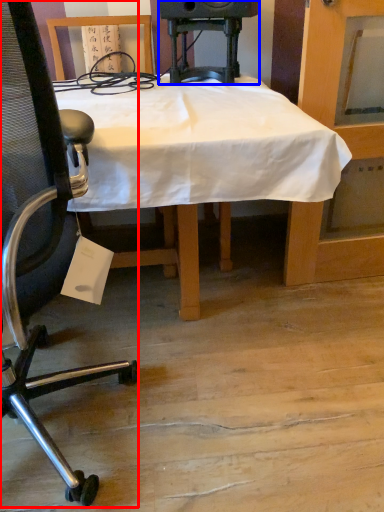
Question: Which object appears farthest to the camera in this image, chair (highlighted by a red box) or speaker (highlighted by a blue box)?

Choices:
 (A) chair
 (B) speaker

Answer: (B)